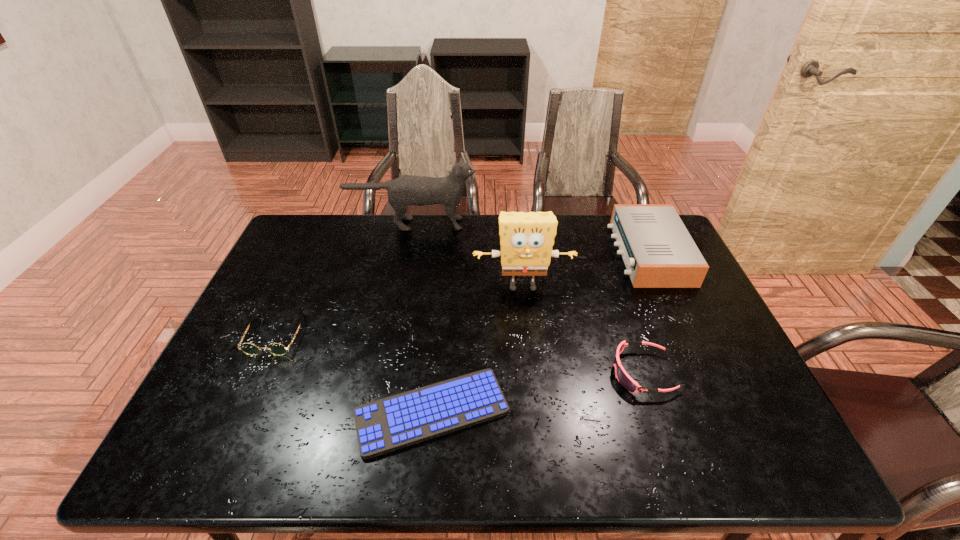
You are a GUI agent. You are given a task and a screenshot of the screen. Output one action in this format:
    pyautogui.click(x=<x>, y=<y>)
    Task: Click on the free space between the cat and the sponge
    
    Given the screenshot: What is the action you would take?
    click(x=468, y=255)

Where is `blank region between the shortest object and the third tallest object`? This screenshot has width=960, height=540. blank region between the shortest object and the third tallest object is located at coordinates (540, 333).

The width and height of the screenshot is (960, 540). Find the location of `vacant area that lies between the third tallest object and the spectacles`. vacant area that lies between the third tallest object and the spectacles is located at coordinates (462, 294).

Image resolution: width=960 pixels, height=540 pixels. I want to click on free space between the sponge and the radio receiver, so click(x=586, y=269).

This screenshot has width=960, height=540. Identify the location of free spot between the spectacles and the goggles. (460, 354).

Where is `vacant region between the goggles and the fourth shortest object`? vacant region between the goggles and the fourth shortest object is located at coordinates (646, 313).

You are a GUI agent. You are given a task and a screenshot of the screen. Output one action in this format:
    pyautogui.click(x=<x>, y=<y>)
    Task: Click on the closest object to the shortest object
    
    Given the screenshot: What is the action you would take?
    pyautogui.click(x=278, y=349)

Find the location of a particular element. object that is the second closest to the spectacles is located at coordinates (406, 190).

You are a GUI agent. You are given a task and a screenshot of the screen. Output one action in this format:
    pyautogui.click(x=<x>, y=<y>)
    Task: Click on the blank space that satisfies the following two spatial constraints: 1. on the lenses of the shortest object; 2. on the right side of the spectacles
    Image resolution: width=960 pixels, height=540 pixels.
    Given the screenshot: What is the action you would take?
    pyautogui.click(x=241, y=412)

Identify the location of free point that satisfies the following two spatial constraints: 1. on the lenses of the spectacles; 2. on the left side of the computer keyboard. (241, 412).